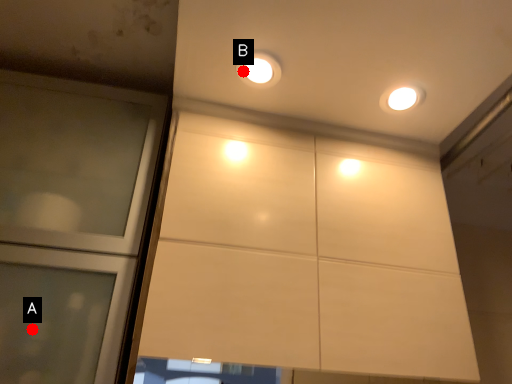
Question: Two points are circled on the image, labeled by A and B beside each circle. Which point appears closest to the camera in this image?

Choices:
 (A) A is closer
 (B) B is closer

Answer: (A)